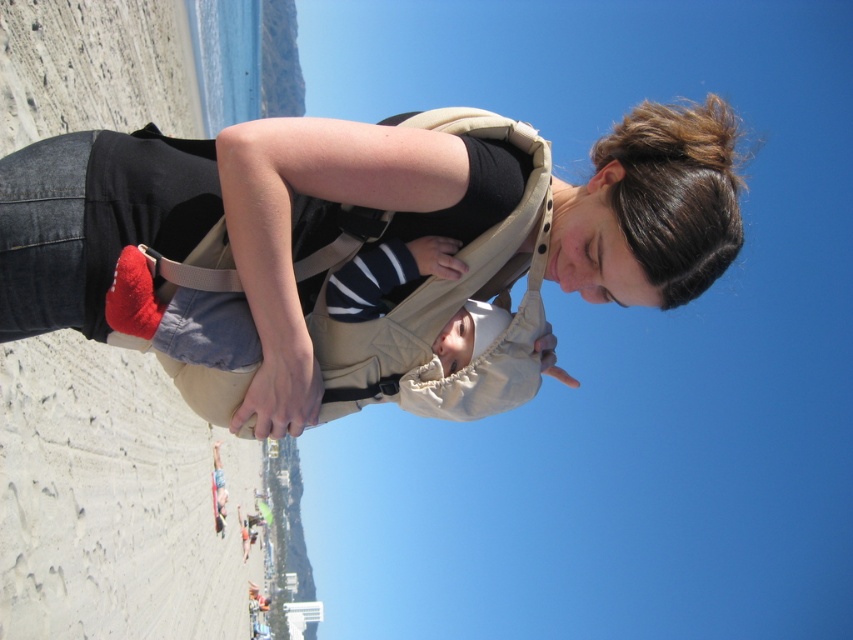
Is the position of matte beige baby carrier at center more distant than that of tan fabric strap at center?

No, matte beige baby carrier at center is in front of tan fabric strap at center.

Who is positioned more to the left, matte beige baby carrier at center or tan fabric strap at center?

tan fabric strap at center

The image size is (853, 640). What are the coordinates of `matte beige baby carrier at center` in the screenshot? It's located at (360, 252).